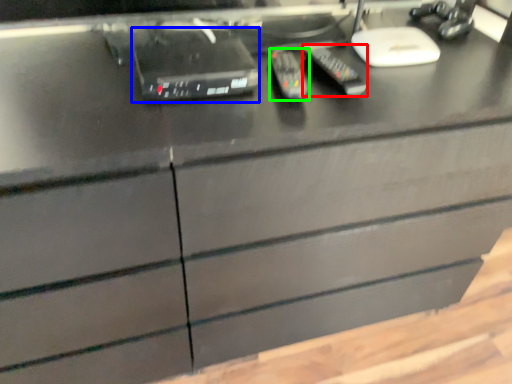
Question: Estimate the real-world distances between objects in this image. Which object is closer to control (highlighted by a red box), equipment (highlighted by a blue box) or control (highlighted by a green box)?

Choices:
 (A) equipment
 (B) control

Answer: (B)